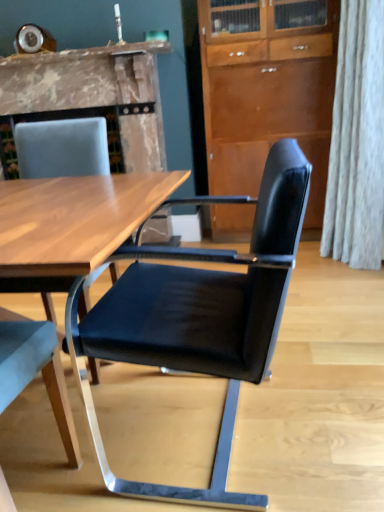
Question: Can you confirm if black leather chair at center, which is the second chair in left-to-right order, is thinner than black leather chair at right, acting as the 2th chair starting from the right?

Choices:
 (A) no
 (B) yes

Answer: (A)

Question: Considering the relative sizes of black leather chair at center, which is the second chair in left-to-right order, and black leather chair at right, acting as the 2th chair starting from the right, in the image provided, is black leather chair at center, which is the second chair in left-to-right order, bigger than black leather chair at right, acting as the 2th chair starting from the right,?

Choices:
 (A) yes
 (B) no

Answer: (A)

Question: Would you say black leather chair at center, which is the second chair in left-to-right order, contains black leather chair at right, the 1th chair viewed from the left?

Choices:
 (A) no
 (B) yes

Answer: (A)

Question: Is black leather chair at center, the first chair viewed from the right, not close to black leather chair at right, acting as the 2th chair starting from the right?

Choices:
 (A) yes
 (B) no

Answer: (B)

Question: Can you confirm if black leather chair at center, the first chair viewed from the right, is shorter than black leather chair at right, the 1th chair viewed from the left?

Choices:
 (A) yes
 (B) no

Answer: (A)

Question: Can we say black leather chair at center, which is the second chair in left-to-right order, lies outside black leather chair at right, the 1th chair viewed from the left?

Choices:
 (A) no
 (B) yes

Answer: (B)

Question: Can you confirm if black leather chair at right, the 1th chair viewed from the left, is positioned to the left of marble fireplace at upper left?

Choices:
 (A) yes
 (B) no

Answer: (B)

Question: From the image's perspective, does black leather chair at right, the 1th chair viewed from the left, appear lower than marble fireplace at upper left?

Choices:
 (A) no
 (B) yes

Answer: (B)

Question: Considering the relative sizes of black leather chair at right, the 1th chair viewed from the left, and marble fireplace at upper left in the image provided, is black leather chair at right, the 1th chair viewed from the left, shorter than marble fireplace at upper left?

Choices:
 (A) yes
 (B) no

Answer: (B)

Question: Could you tell me if black leather chair at right, the 1th chair viewed from the left, is facing marble fireplace at upper left?

Choices:
 (A) yes
 (B) no

Answer: (B)

Question: Is black leather chair at right, acting as the 2th chair starting from the right, next to marble fireplace at upper left and touching it?

Choices:
 (A) no
 (B) yes

Answer: (A)

Question: Would you say black leather chair at right, the 1th chair viewed from the left, is outside marble fireplace at upper left?

Choices:
 (A) no
 (B) yes

Answer: (B)

Question: Is marble fireplace at upper left turned away from black leather chair at center, which is the second chair in left-to-right order?

Choices:
 (A) no
 (B) yes

Answer: (A)